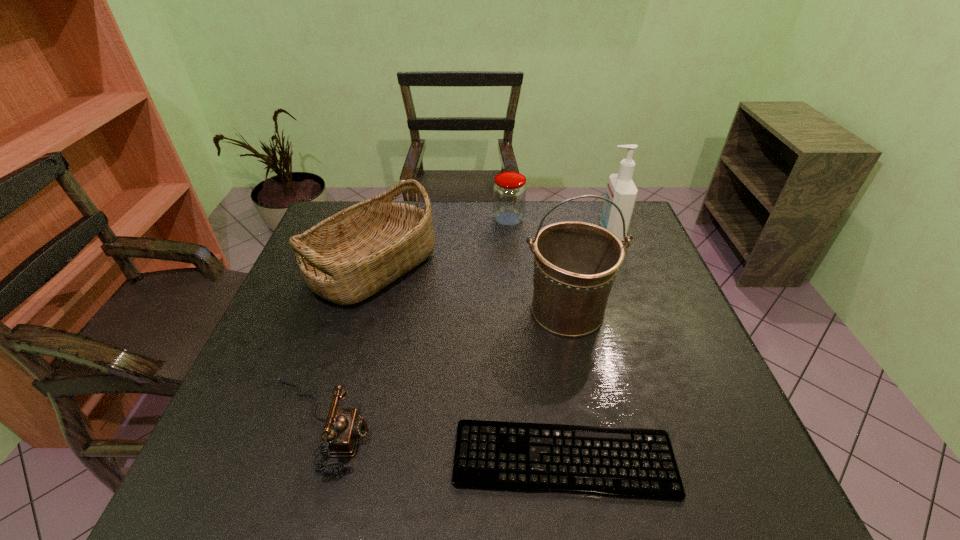
The height and width of the screenshot is (540, 960). In order to click on bucket in this screenshot , I will do `click(575, 263)`.

Find the location of a particular element. This screenshot has height=540, width=960. the rightmost object is located at coordinates (621, 190).

Where is `cleansing agent`? This screenshot has height=540, width=960. cleansing agent is located at coordinates (621, 190).

Where is `basket`? Image resolution: width=960 pixels, height=540 pixels. basket is located at coordinates (348, 257).

Locate an element on the screen. This screenshot has width=960, height=540. the fourth tallest object is located at coordinates (509, 191).

This screenshot has height=540, width=960. I want to click on telephone, so click(x=344, y=426).

Where is `computer keyboard`? The width and height of the screenshot is (960, 540). computer keyboard is located at coordinates (x=630, y=463).

The image size is (960, 540). I want to click on free location located 0.210m on the left of the bucket, so click(x=440, y=311).

I want to click on vacant space situated on the front label of the cleansing agent, so click(x=475, y=232).

Where is `free spot located on the front label of the cleansing agent`? The image size is (960, 540). free spot located on the front label of the cleansing agent is located at coordinates (559, 232).